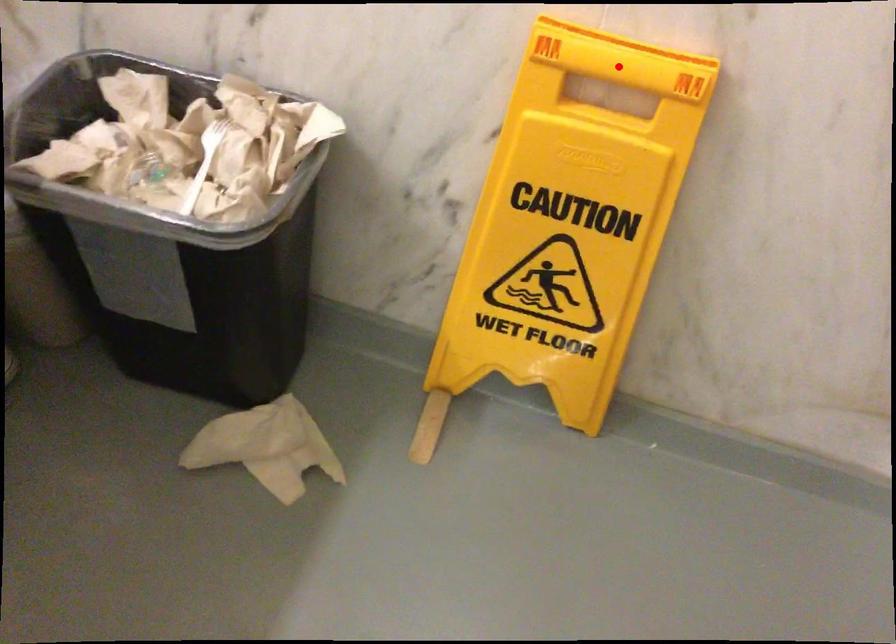
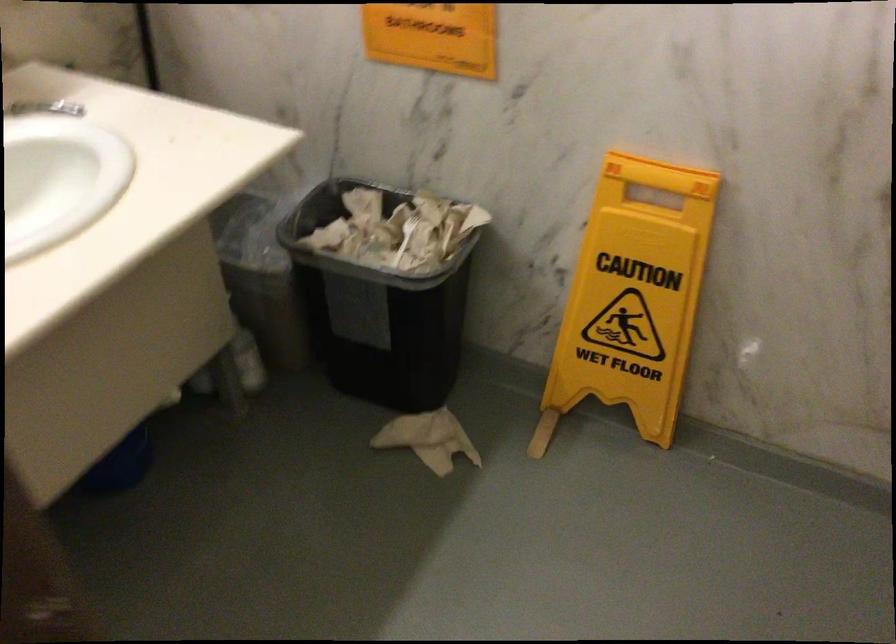
In the second image, find the point that corresponds to the highlighted location in the first image.

(659, 175)